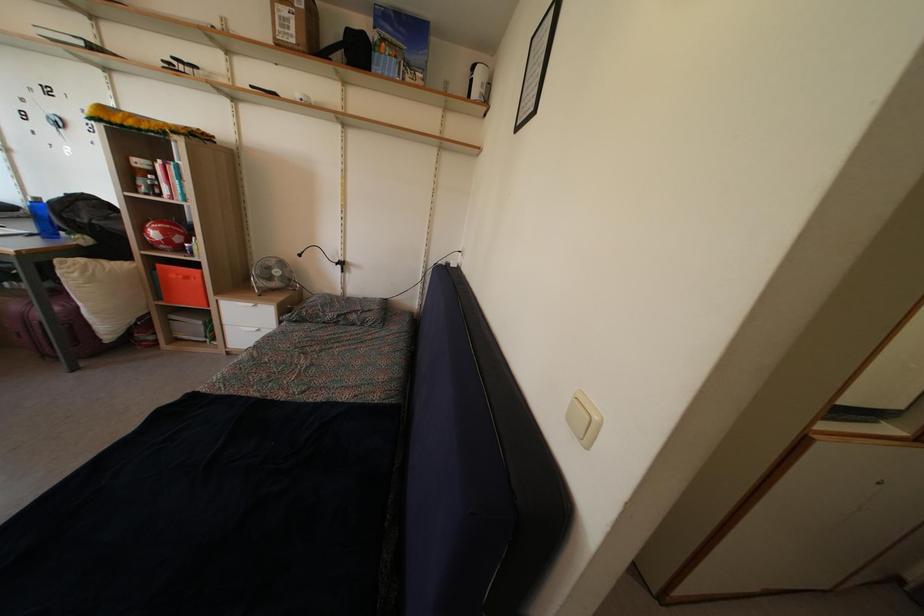
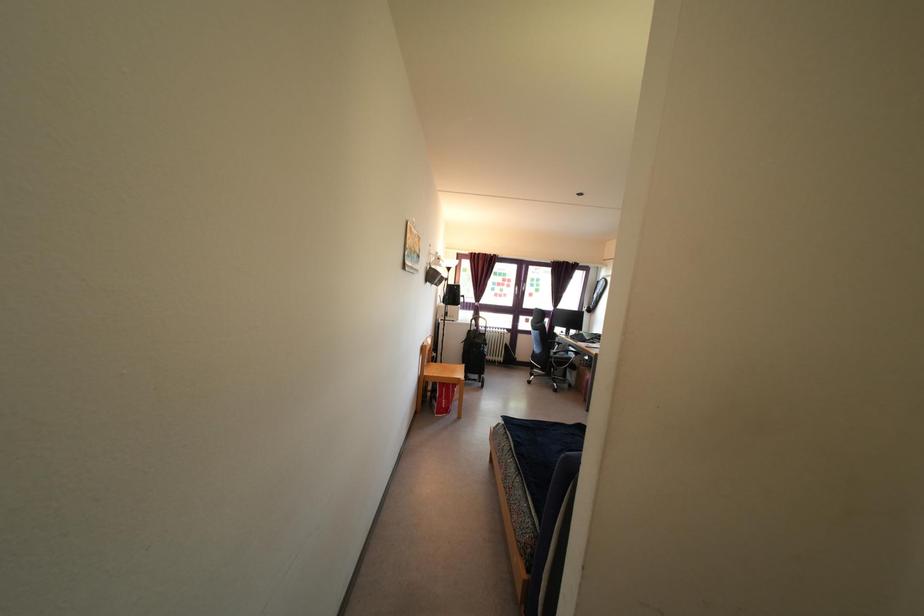
Question: Based on the continuous images, in which direction is the camera rotating? Reply with the corresponding letter.

Choices:
 (A) Left
 (B) Right
 (C) Up
 (D) Down

Answer: (A)